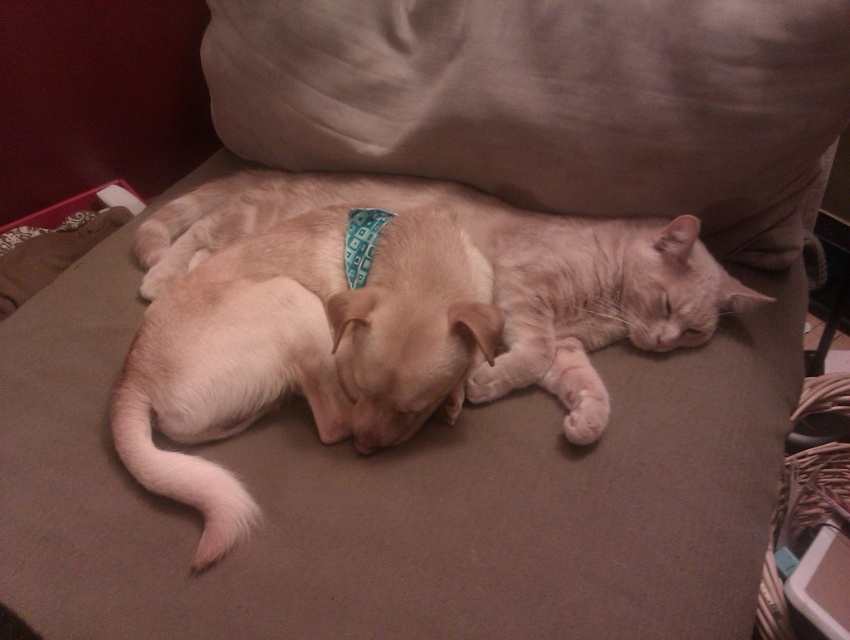
Is the position of beige fabric pillow at upper center less distant than that of fuzzy beige dog at center?

No.

Can you confirm if beige fabric pillow at upper center is positioned below fuzzy beige dog at center?

Incorrect, beige fabric pillow at upper center is not positioned below fuzzy beige dog at center.

Locate an element on the screen. This screenshot has width=850, height=640. beige fabric pillow at upper center is located at coordinates (550, 100).

Is fuzzy beige dog at center thinner than light brown fur at center?

Yes.

Is point (221, 269) positioned in front of point (573, 381)?

No, it is not.

At what (x,y) coordinates should I click in order to perform the action: click on fuzzy beige dog at center. Please return your answer as a coordinate pair (x, y). Looking at the image, I should click on (299, 349).

Between point (550, 83) and point (579, 324), which one is positioned behind?

Positioned behind is point (579, 324).

Does beige fabric pillow at upper center appear over light brown fur at center?

Indeed, beige fabric pillow at upper center is positioned over light brown fur at center.

Is point (571, 100) positioned behind point (414, 189)?

No, it is in front of (414, 189).

Find the location of `beige fabric pillow at upper center`. beige fabric pillow at upper center is located at coordinates (550, 100).